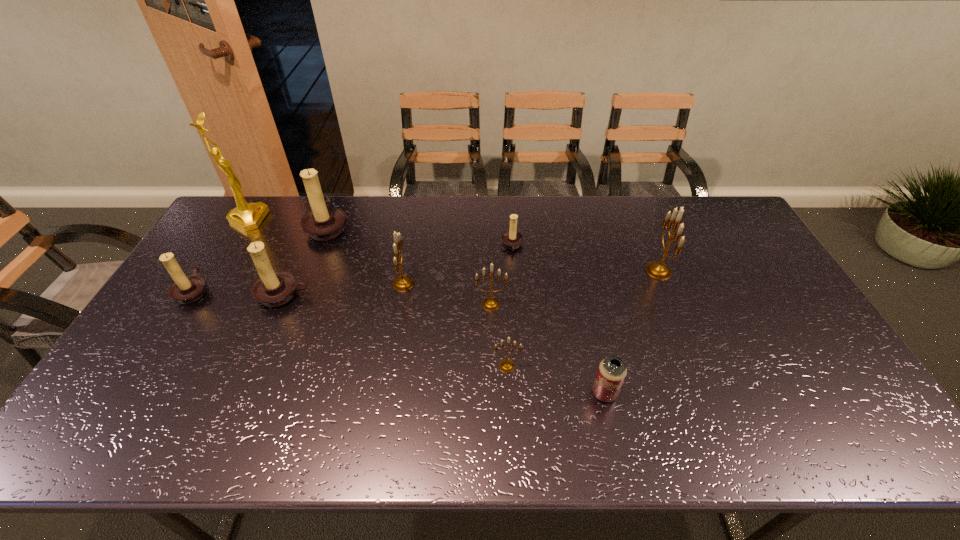
At what (x,y) coordinates should I click in order to perform the action: click on award that is positioned at the left edge. Please return your answer as a coordinate pair (x, y). The height and width of the screenshot is (540, 960). Looking at the image, I should click on (247, 216).

You are a GUI agent. You are given a task and a screenshot of the screen. Output one action in this format:
    pyautogui.click(x=<x>, y=<y>)
    Task: Click on the candle holder present at the left edge
    The height and width of the screenshot is (540, 960).
    Given the screenshot: What is the action you would take?
    pyautogui.click(x=186, y=290)

Locate an element on the screen. object located at the far left corner is located at coordinates (247, 216).

The image size is (960, 540). I want to click on vacant space at the far edge, so click(567, 199).

Find the location of a particular element. The height and width of the screenshot is (540, 960). vacant space at the near edge is located at coordinates (339, 417).

In the image, there is a desktop. At what (x,y) coordinates should I click in order to perform the action: click on free region at the left edge. Please return your answer as a coordinate pair (x, y). The height and width of the screenshot is (540, 960). Looking at the image, I should click on (236, 240).

You are a GUI agent. You are given a task and a screenshot of the screen. Output one action in this format:
    pyautogui.click(x=<x>, y=<y>)
    Task: Click on the free region at the right edge of the desktop
    
    Given the screenshot: What is the action you would take?
    pyautogui.click(x=742, y=244)

This screenshot has width=960, height=540. Identify the location of vacant position at the near left corner of the desktop. (140, 423).

Image resolution: width=960 pixels, height=540 pixels. What are the coordinates of `free space that is in between the sixth object from right to left and the award` in the screenshot? It's located at (325, 252).

The height and width of the screenshot is (540, 960). Identify the location of free point between the rightmost brown candle holder and the biggest brown candle holder. (x=420, y=236).